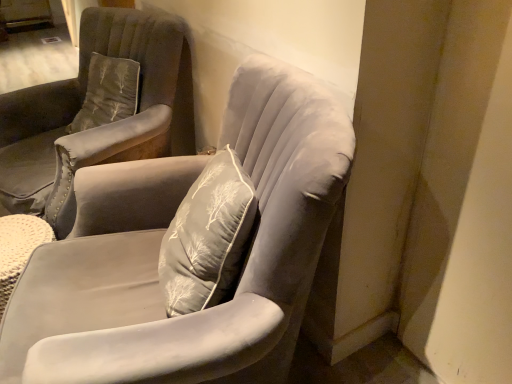
Question: Which direction should I rotate to look at suede gray armchair at center, marked as the 1th chair in a back-to-front arrangement?

Choices:
 (A) left
 (B) right

Answer: (A)

Question: Is suede gray armchair at center, marked as the 1th chair in a back-to-front arrangement, positioned far away from velvet gray chair at center, the first chair in the front-to-back sequence?

Choices:
 (A) no
 (B) yes

Answer: (A)

Question: Considering the relative positions of suede gray armchair at center, marked as the 1th chair in a back-to-front arrangement, and velvet gray chair at center, the first chair in the front-to-back sequence, in the image provided, is suede gray armchair at center, marked as the 1th chair in a back-to-front arrangement, in front of velvet gray chair at center, the first chair in the front-to-back sequence,?

Choices:
 (A) no
 (B) yes

Answer: (A)

Question: Is suede gray armchair at center, the second chair from the front, further to the viewer compared to velvet gray chair at center, acting as the 2th chair starting from the back?

Choices:
 (A) no
 (B) yes

Answer: (B)

Question: From the image's perspective, is suede gray armchair at center, marked as the 1th chair in a back-to-front arrangement, on velvet gray chair at center, acting as the 2th chair starting from the back?

Choices:
 (A) yes
 (B) no

Answer: (A)

Question: From a real-world perspective, is suede gray armchair at center, the second chair from the front, on velvet gray chair at center, the first chair in the front-to-back sequence?

Choices:
 (A) no
 (B) yes

Answer: (B)

Question: Could velvet gray chair at center, the first chair in the front-to-back sequence, be considered to be inside suede gray armchair at center, marked as the 1th chair in a back-to-front arrangement?

Choices:
 (A) yes
 (B) no

Answer: (B)

Question: Does velvet gray chair at center, the first chair in the front-to-back sequence, have a lesser width compared to suede gray armchair at center, the second chair from the front?

Choices:
 (A) no
 (B) yes

Answer: (B)

Question: Is velvet gray chair at center, acting as the 2th chair starting from the back, in front of suede gray armchair at center, the second chair from the front?

Choices:
 (A) no
 (B) yes

Answer: (B)

Question: From a real-world perspective, is velvet gray chair at center, acting as the 2th chair starting from the back, located beneath suede gray armchair at center, marked as the 1th chair in a back-to-front arrangement?

Choices:
 (A) yes
 (B) no

Answer: (A)

Question: Would you consider velvet gray chair at center, acting as the 2th chair starting from the back, to be distant from suede gray armchair at center, the second chair from the front?

Choices:
 (A) yes
 (B) no

Answer: (B)

Question: Could suede gray armchair at center, the second chair from the front, be considered to be inside velvet gray chair at center, the first chair in the front-to-back sequence?

Choices:
 (A) no
 (B) yes

Answer: (A)

Question: Is velvet gray chair at center, the first chair in the front-to-back sequence, taller than suede gray armchair at center, the second chair from the front?

Choices:
 (A) no
 (B) yes

Answer: (B)

Question: In terms of size, does velvet gray chair at center, acting as the 2th chair starting from the back, appear bigger or smaller than suede gray armchair at center, the second chair from the front?

Choices:
 (A) small
 (B) big

Answer: (A)